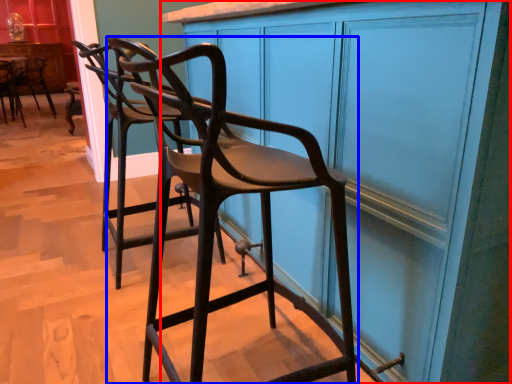
Question: Among these objects, which one is nearest to the camera, cabinetry (highlighted by a red box) or chair (highlighted by a blue box)?

Choices:
 (A) cabinetry
 (B) chair

Answer: (A)